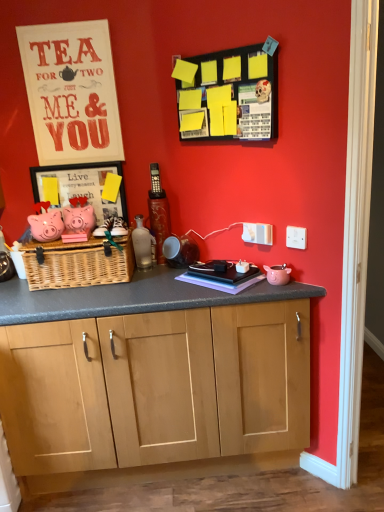
Question: Considering the relative sizes of purple matte book at center and matte white signboard at upper left in the image provided, is purple matte book at center bigger than matte white signboard at upper left?

Choices:
 (A) yes
 (B) no

Answer: (B)

Question: Considering the relative sizes of purple matte book at center and matte white signboard at upper left in the image provided, is purple matte book at center smaller than matte white signboard at upper left?

Choices:
 (A) no
 (B) yes

Answer: (B)

Question: Could you tell me if purple matte book at center is turned towards matte white signboard at upper left?

Choices:
 (A) no
 (B) yes

Answer: (A)

Question: Are purple matte book at center and matte white signboard at upper left far apart?

Choices:
 (A) yes
 (B) no

Answer: (B)

Question: From a real-world perspective, is purple matte book at center on top of matte white signboard at upper left?

Choices:
 (A) no
 (B) yes

Answer: (A)

Question: Considering the positions of yellow paper at upper center and translucent glass bottle at center in the image, is yellow paper at upper center taller or shorter than translucent glass bottle at center?

Choices:
 (A) tall
 (B) short

Answer: (A)

Question: Choose the correct answer: Is yellow paper at upper center inside translucent glass bottle at center or outside it?

Choices:
 (A) outside
 (B) inside

Answer: (A)

Question: Is yellow paper at upper center bigger or smaller than translucent glass bottle at center?

Choices:
 (A) small
 (B) big

Answer: (B)

Question: Looking at their shapes, would you say yellow paper at upper center is wider or thinner than translucent glass bottle at center?

Choices:
 (A) wide
 (B) thin

Answer: (B)

Question: Relative to pink matte piggy bank at left, is translucent glass bottle at center in front or behind?

Choices:
 (A) behind
 (B) front

Answer: (A)

Question: Visually, is translucent glass bottle at center positioned to the left or to the right of pink matte piggy bank at left?

Choices:
 (A) right
 (B) left

Answer: (A)

Question: Considering the positions of translucent glass bottle at center and pink matte piggy bank at left in the image, is translucent glass bottle at center taller or shorter than pink matte piggy bank at left?

Choices:
 (A) short
 (B) tall

Answer: (B)

Question: Based on their sizes in the image, would you say translucent glass bottle at center is bigger or smaller than pink matte piggy bank at left?

Choices:
 (A) small
 (B) big

Answer: (A)

Question: Considering the relative positions of purple matte book at center and yellow paper at upper center in the image provided, is purple matte book at center to the left or to the right of yellow paper at upper center?

Choices:
 (A) left
 (B) right

Answer: (B)

Question: Looking at the image, does purple matte book at center seem bigger or smaller compared to yellow paper at upper center?

Choices:
 (A) small
 (B) big

Answer: (A)